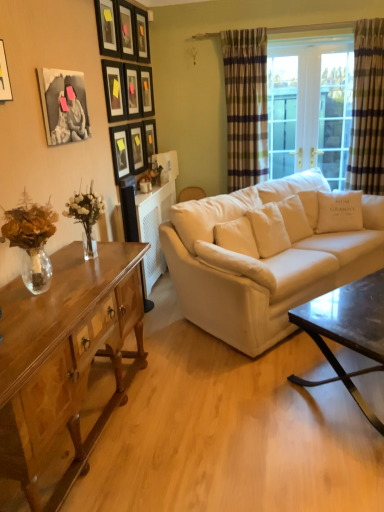
I want to click on empty space that is ontop of light brown wooden coffee table at lower left, which appears as the 1th coffee table when viewed from the left, so click(66, 284).